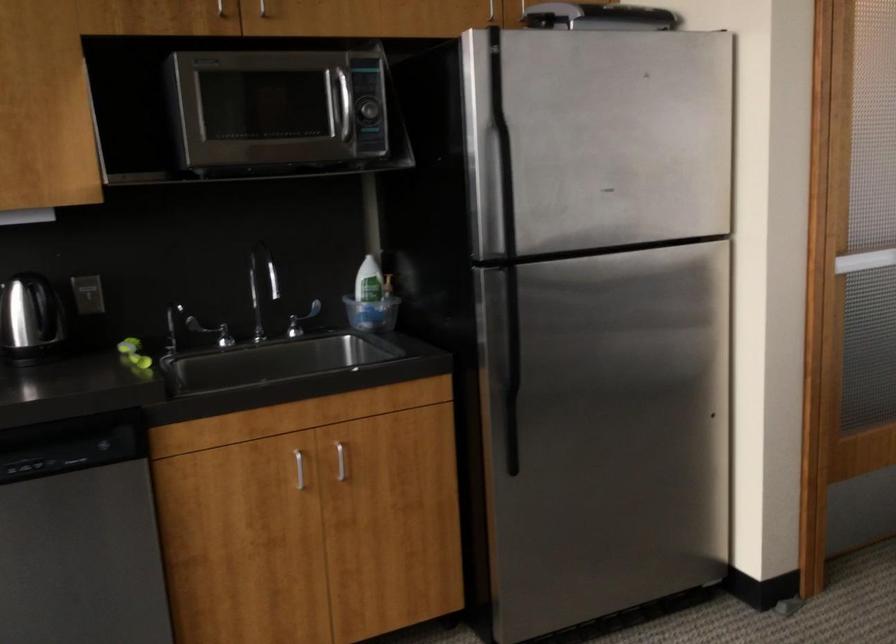
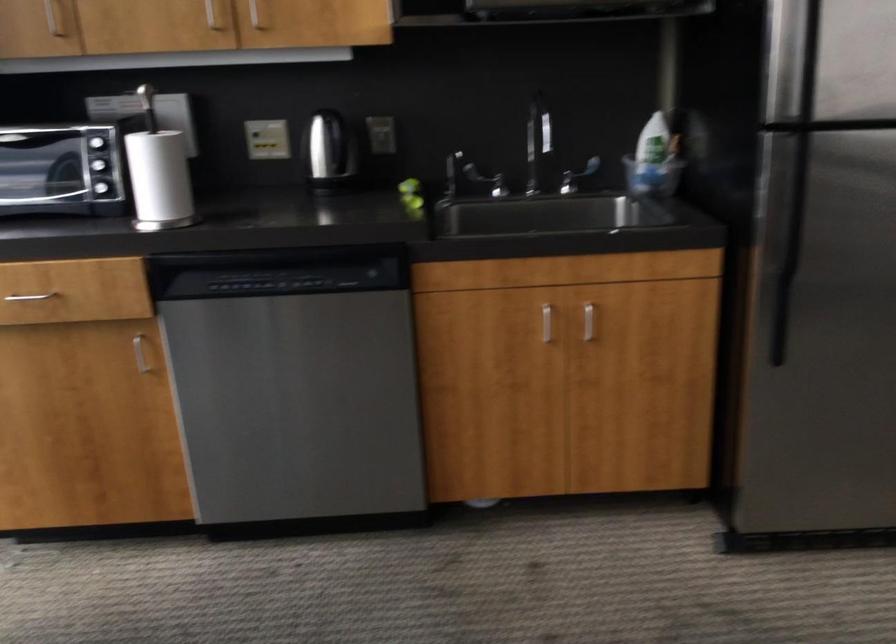
Where in the second image is the point corresponding to point (341, 462) from the first image?

(588, 321)